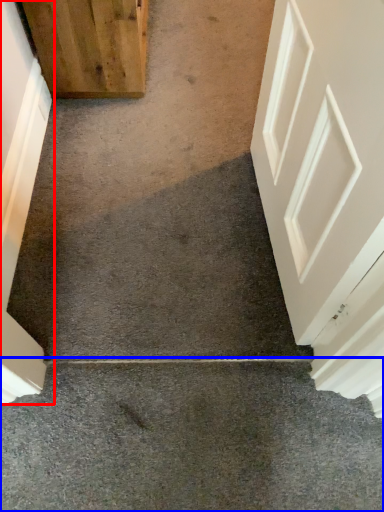
Question: Which point is closer to the camera, door (highlighted by a red box) or concrete (highlighted by a blue box)?

Choices:
 (A) door
 (B) concrete

Answer: (B)